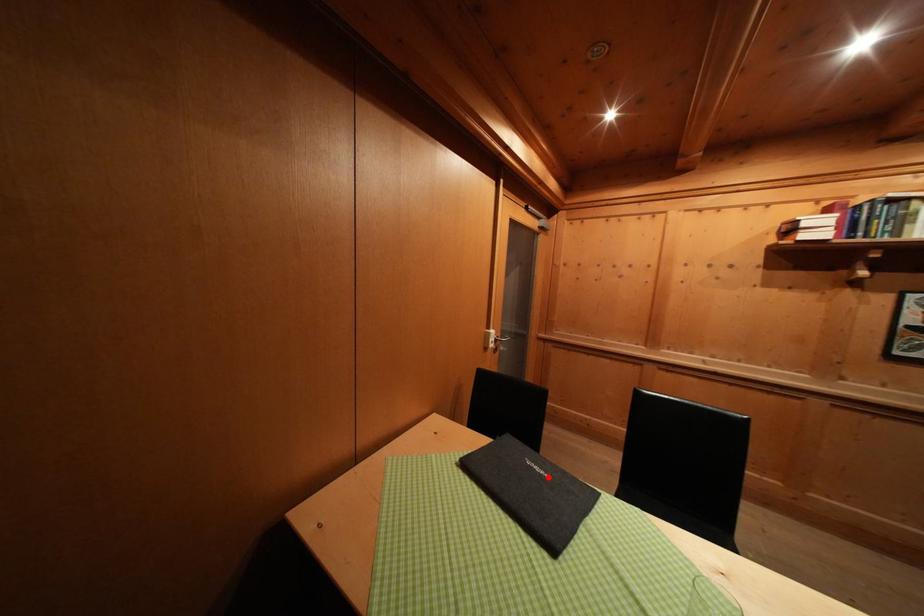
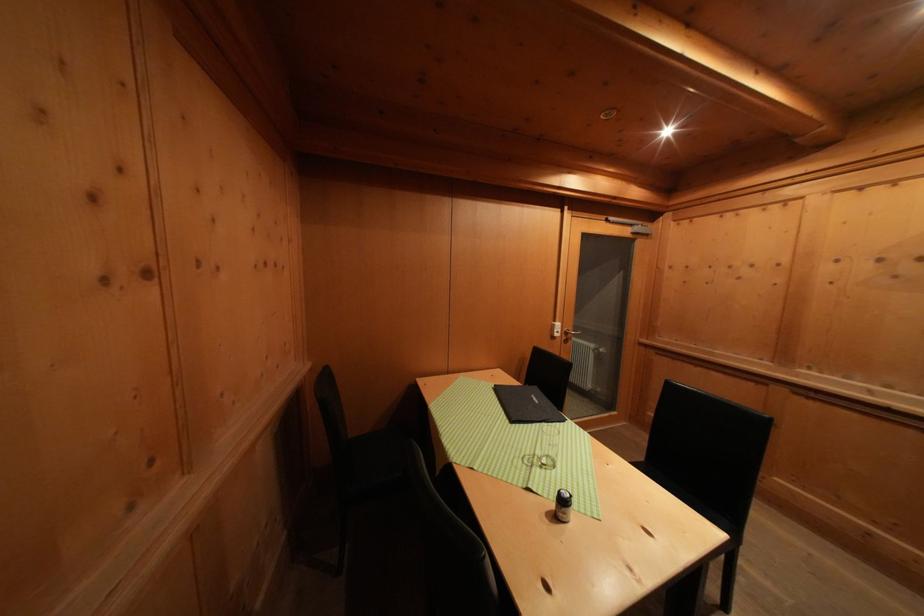
In the second image, find the point that corresponds to the highlighted location in the first image.

(542, 406)